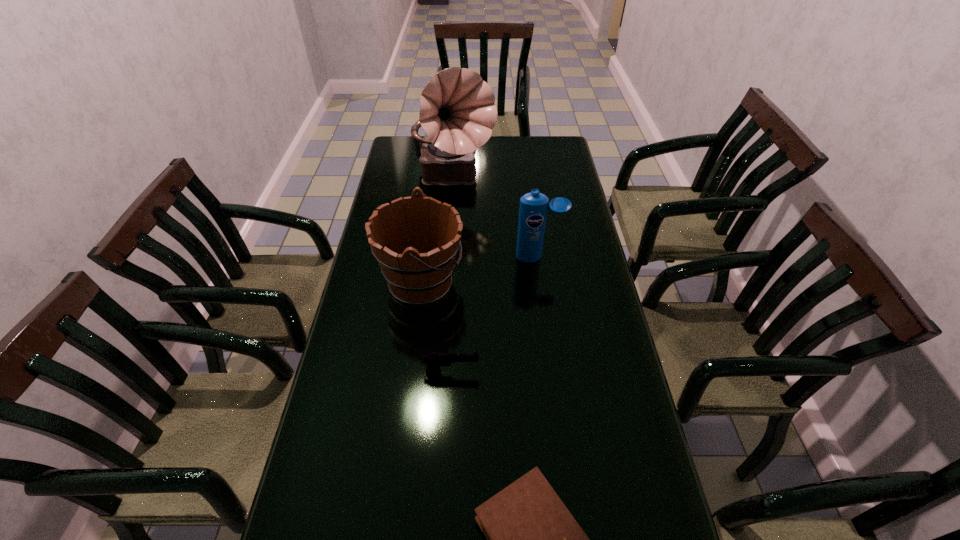
In order to click on object at the far edge in this screenshot , I will do `click(457, 112)`.

Find the location of `record player present at the left edge`. record player present at the left edge is located at coordinates 457,112.

This screenshot has width=960, height=540. Find the location of `wine bucket at the left edge`. wine bucket at the left edge is located at coordinates (421, 274).

Where is `object at the right edge`? object at the right edge is located at coordinates (533, 209).

Find the location of a particular element. object that is at the far left corner is located at coordinates (457, 112).

In the image, there is a desktop. In order to click on vacant space at the far edge in this screenshot , I will do `click(494, 152)`.

Locate an element on the screen. This screenshot has height=540, width=960. vacant space at the left edge of the desktop is located at coordinates (353, 353).

At what (x,y) coordinates should I click in order to perform the action: click on blank space at the right edge. Please return your answer as a coordinate pair (x, y). The width and height of the screenshot is (960, 540). Looking at the image, I should click on (570, 260).

Identify the location of vacant space that is in between the second shortest object and the wine bucket. The width and height of the screenshot is (960, 540). (436, 327).

Locate an element on the screen. vacant area that lies between the second shortest object and the shampoo is located at coordinates (494, 314).